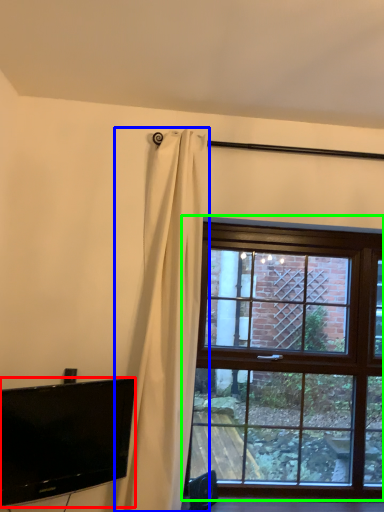
Question: Which object is the closest to the television (highlighted by a red box)? Choose among these: curtain (highlighted by a blue box) or window (highlighted by a green box).

Choices:
 (A) curtain
 (B) window

Answer: (A)